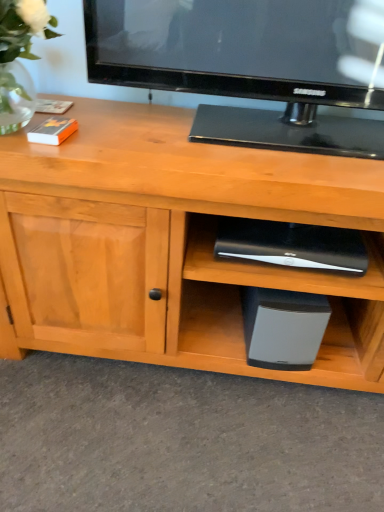
Question: Is clear glass vase at upper left at the left side of black plastic speaker at lower center, the second appliance when ordered from bottom to top?

Choices:
 (A) yes
 (B) no

Answer: (A)

Question: Is clear glass vase at upper left behind black plastic speaker at lower center, the second appliance when ordered from bottom to top?

Choices:
 (A) yes
 (B) no

Answer: (B)

Question: Is clear glass vase at upper left outside black plastic speaker at lower center, the second appliance when ordered from bottom to top?

Choices:
 (A) yes
 (B) no

Answer: (A)

Question: Considering the relative positions of clear glass vase at upper left and black plastic speaker at lower center, the second appliance when ordered from bottom to top, in the image provided, is clear glass vase at upper left to the right of black plastic speaker at lower center, the second appliance when ordered from bottom to top, from the viewer's perspective?

Choices:
 (A) no
 (B) yes

Answer: (A)

Question: Does clear glass vase at upper left have a greater width compared to black plastic speaker at lower center, placed as the 1th appliance when sorted from top to bottom?

Choices:
 (A) no
 (B) yes

Answer: (B)

Question: Can you confirm if clear glass vase at upper left is taller than black plastic speaker at lower center, placed as the 1th appliance when sorted from top to bottom?

Choices:
 (A) no
 (B) yes

Answer: (B)

Question: Can you confirm if black plastic speaker at lower center, the second appliance when ordered from bottom to top, is wider than clear glass vase at upper left?

Choices:
 (A) no
 (B) yes

Answer: (A)

Question: Is black plastic speaker at lower center, placed as the 1th appliance when sorted from top to bottom, closer to camera compared to clear glass vase at upper left?

Choices:
 (A) no
 (B) yes

Answer: (A)

Question: Considering the relative sizes of black plastic speaker at lower center, the second appliance when ordered from bottom to top, and clear glass vase at upper left in the image provided, is black plastic speaker at lower center, the second appliance when ordered from bottom to top, bigger than clear glass vase at upper left?

Choices:
 (A) yes
 (B) no

Answer: (B)

Question: Is black plastic speaker at lower center, placed as the 1th appliance when sorted from top to bottom, shorter than clear glass vase at upper left?

Choices:
 (A) yes
 (B) no

Answer: (A)

Question: Is black plastic speaker at lower center, the second appliance when ordered from bottom to top, at the left side of clear glass vase at upper left?

Choices:
 (A) no
 (B) yes

Answer: (A)

Question: Is black plastic speaker at lower center, placed as the 1th appliance when sorted from top to bottom, thinner than clear glass vase at upper left?

Choices:
 (A) yes
 (B) no

Answer: (A)

Question: Can you confirm if black matte speaker at lower center, the 2th appliance in the top-to-bottom sequence, is shorter than black plastic speaker at lower center, the second appliance when ordered from bottom to top?

Choices:
 (A) no
 (B) yes

Answer: (A)